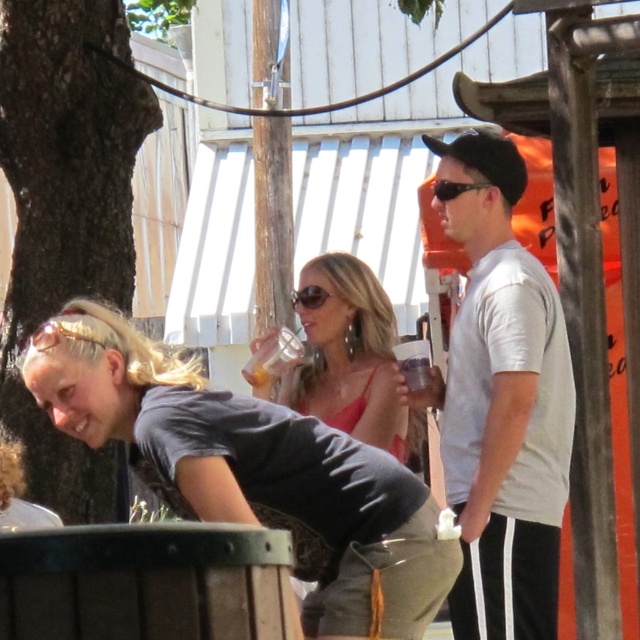
Question: Which is nearer to the translucent plastic cup at center?

Choices:
 (A) black plastic sunglasses at upper center
 (B) white matte t-shirt at right
 (C) sunglasses at center

Answer: (B)

Question: Among these objects, which one is nearest to the camera?

Choices:
 (A) black plastic sunglasses at upper center
 (B) white matte t-shirt at right

Answer: (B)

Question: Estimate the real-world distances between objects in this image. Which object is closer to the matte gray shirt at lower left?

Choices:
 (A) matte pink dress at center
 (B) sunglasses at center
 (C) brown rough bark tree at left
 (D) white matte t-shirt at right

Answer: (D)

Question: Is white matte t-shirt at right below black plastic sunglasses at upper center?

Choices:
 (A) yes
 (B) no

Answer: (A)

Question: Is matte gray shirt at lower left to the left of translucent plastic cup at center from the viewer's perspective?

Choices:
 (A) no
 (B) yes

Answer: (B)

Question: In this image, where is brown rough bark tree at left located relative to black plastic sunglasses at upper center?

Choices:
 (A) below
 (B) above

Answer: (A)